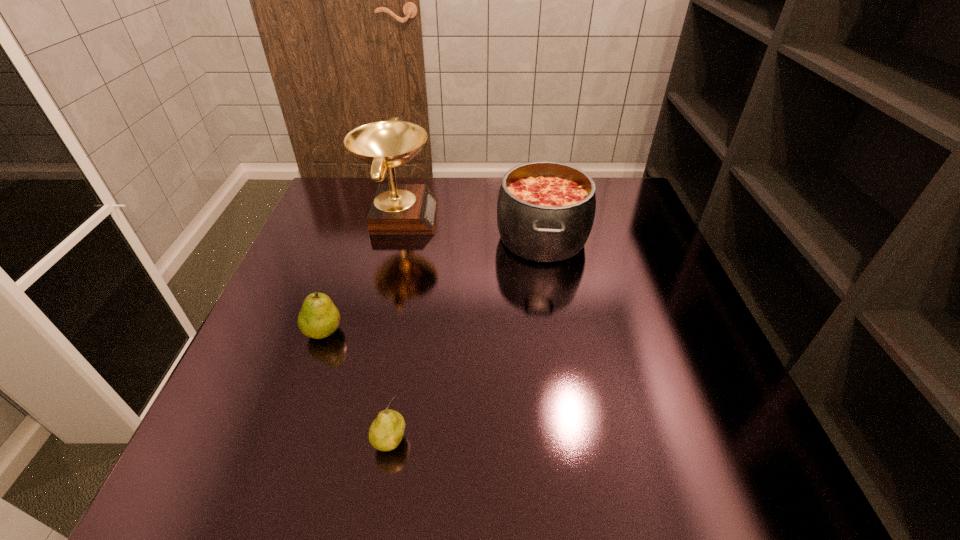
The width and height of the screenshot is (960, 540). Identify the location of the tallest object. (397, 209).

The height and width of the screenshot is (540, 960). I want to click on the rightmost object, so click(x=545, y=211).

Where is `the second tallest object`? the second tallest object is located at coordinates (545, 211).

At what (x,y) coordinates should I click in order to perform the action: click on the second nearest object. Please return your answer as a coordinate pair (x, y). The height and width of the screenshot is (540, 960). Looking at the image, I should click on tap(318, 318).

In order to click on the left pear in this screenshot , I will do `click(318, 318)`.

At what (x,y) coordinates should I click in order to perform the action: click on the shorter pear. Please return your answer as a coordinate pair (x, y). Looking at the image, I should click on (386, 432).

You are a GUI agent. You are given a task and a screenshot of the screen. Output one action in this format:
    pyautogui.click(x=<x>, y=<y>)
    Task: Click on the right pear
    The image size is (960, 540).
    Given the screenshot: What is the action you would take?
    pyautogui.click(x=386, y=432)

I want to click on free spot located on the front-facing side of the tallest object, so click(x=481, y=215).

Locate an element on the screen. The image size is (960, 540). blank space located 0.200m on the left of the rightmost object is located at coordinates (419, 238).

This screenshot has height=540, width=960. Identify the location of vacant space situated 0.130m on the front of the third farthest object. (299, 405).